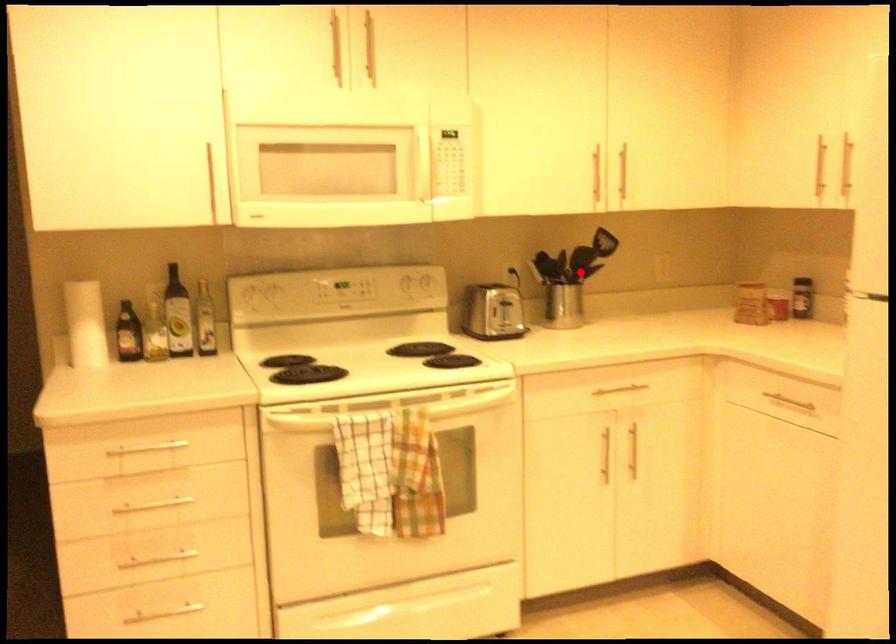
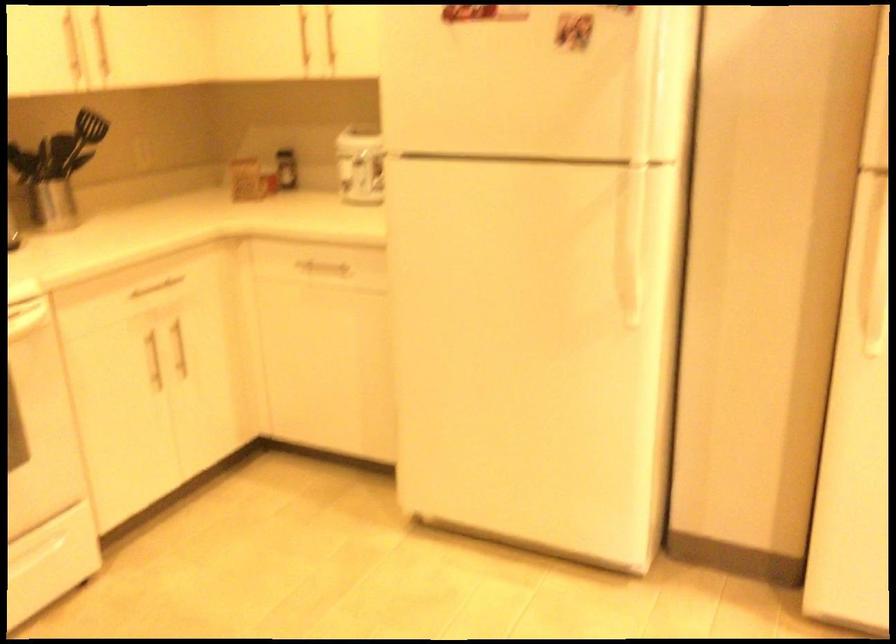
Question: I am providing you with two images of the same scene from different viewpoints. Image1 has a red point marked. In image2, the corresponding 3D location appears at what relative position? Reply with the corresponding letter.

Choices:
 (A) Closer
 (B) Farther

Answer: (A)